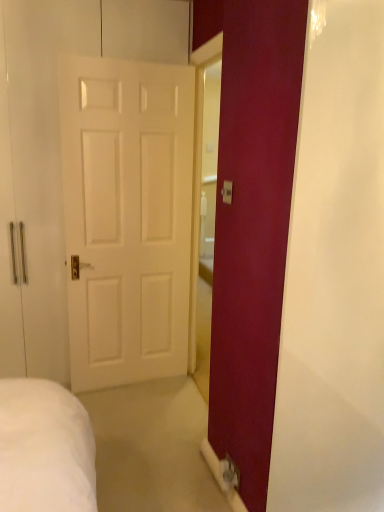
This screenshot has width=384, height=512. What do you see at coordinates (126, 217) in the screenshot?
I see `white matte door at left` at bounding box center [126, 217].

Where is `white matte door at left`? The width and height of the screenshot is (384, 512). white matte door at left is located at coordinates (126, 217).

I want to click on white matte door at left, so click(126, 217).